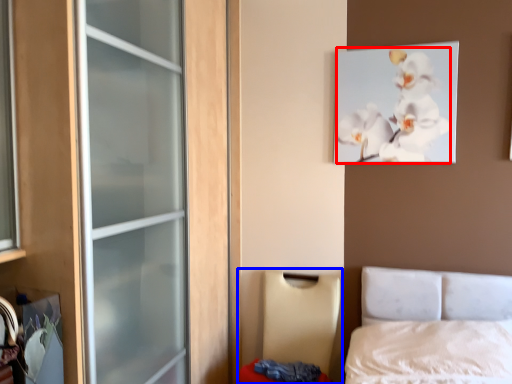
Question: Which object is further to the camera taking this photo, flower (highlighted by a red box) or furniture (highlighted by a blue box)?

Choices:
 (A) flower
 (B) furniture

Answer: (A)